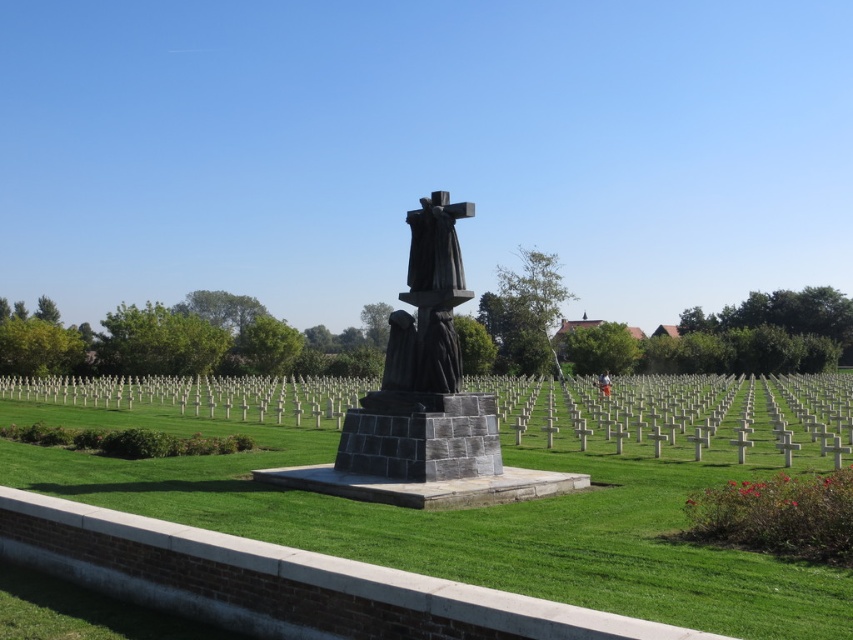
Question: From the image, what is the correct spatial relationship of dark gray stone sculpture at center in relation to dark gray stone statue at center?

Choices:
 (A) above
 (B) below

Answer: (B)

Question: Is dark gray stone statue at center to the left of light brown wooden stick at center from the viewer's perspective?

Choices:
 (A) no
 (B) yes

Answer: (B)

Question: Among these objects, which one is nearest to the camera?

Choices:
 (A) dark gray stone statue at center
 (B) light brown wooden stick at center
 (C) dark gray stone sculpture at center

Answer: (C)

Question: Which object is the farthest from the dark gray stone statue at center?

Choices:
 (A) dark gray stone sculpture at center
 (B) light brown wooden stick at center

Answer: (B)

Question: Is dark gray stone statue at center to the right of light brown wooden stick at center from the viewer's perspective?

Choices:
 (A) yes
 (B) no

Answer: (B)

Question: Which point is farther to the camera?

Choices:
 (A) (398, 310)
 (B) (389, 316)

Answer: (B)